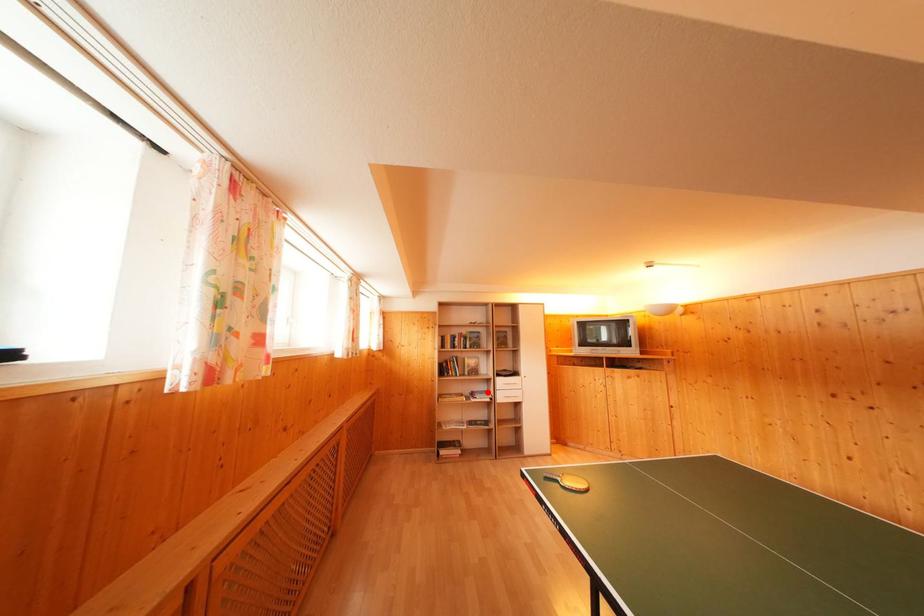
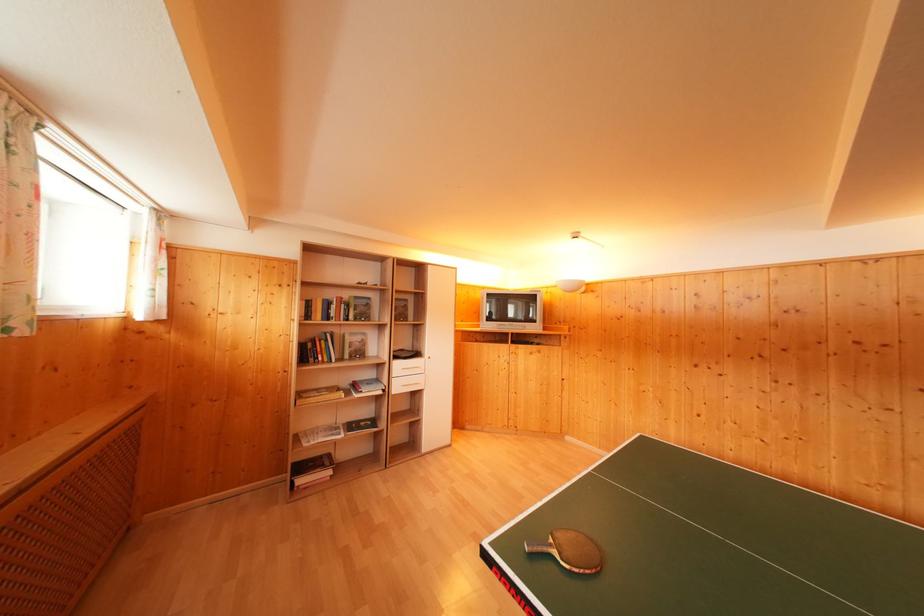
In the second image, find the point that corresponds to the highlighted location in the first image.

(375, 379)